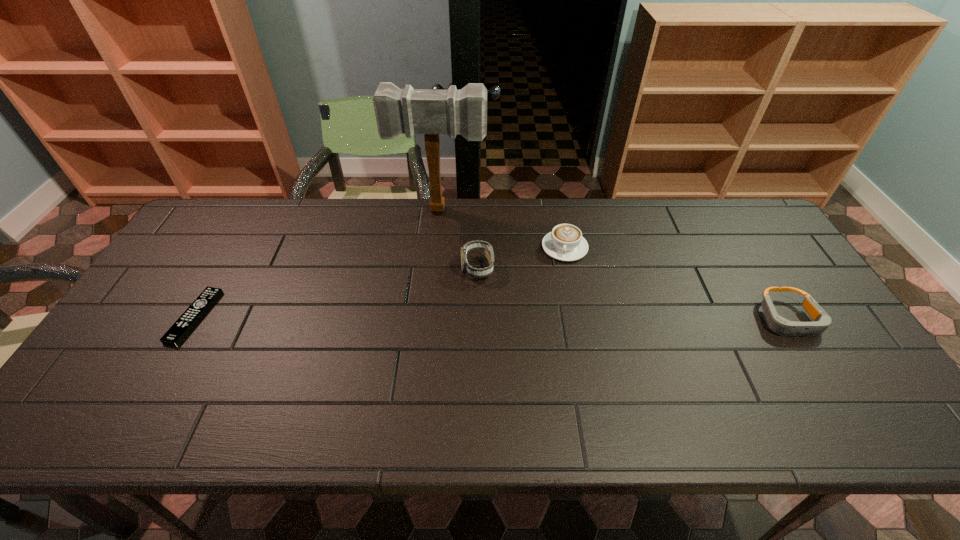
What are the coordinates of `vacant spot on the desktop that is between the remote control and the goggles and is positioned at the head of the mallet` in the screenshot? It's located at (423, 318).

I want to click on vacant space on the desktop that is between the leftmost object and the second shortest object and is positioned on the face of the fourth shortest object, so click(432, 318).

Locate an element on the screen. This screenshot has width=960, height=540. free space on the desktop that is between the remote control and the second shortest object and is positioned with the handle on the right side of the cappuccino is located at coordinates (565, 318).